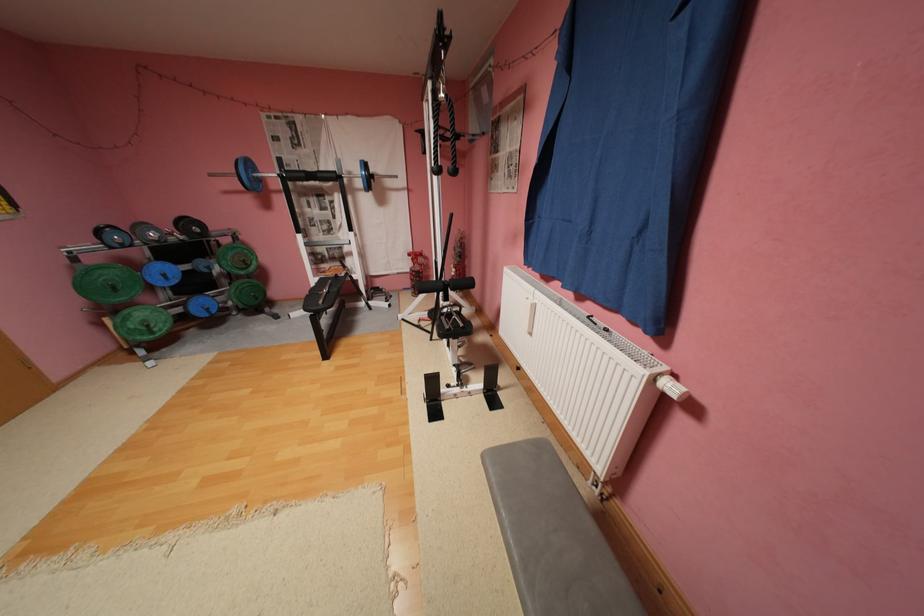
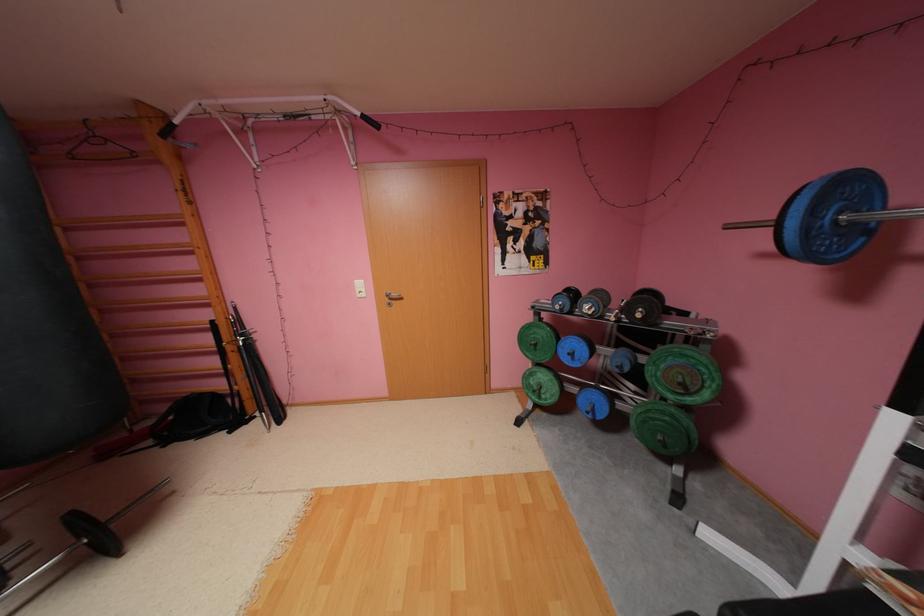
The point at (x=216, y=315) is marked in the first image. Where is the corresponding point in the second image?

(600, 416)